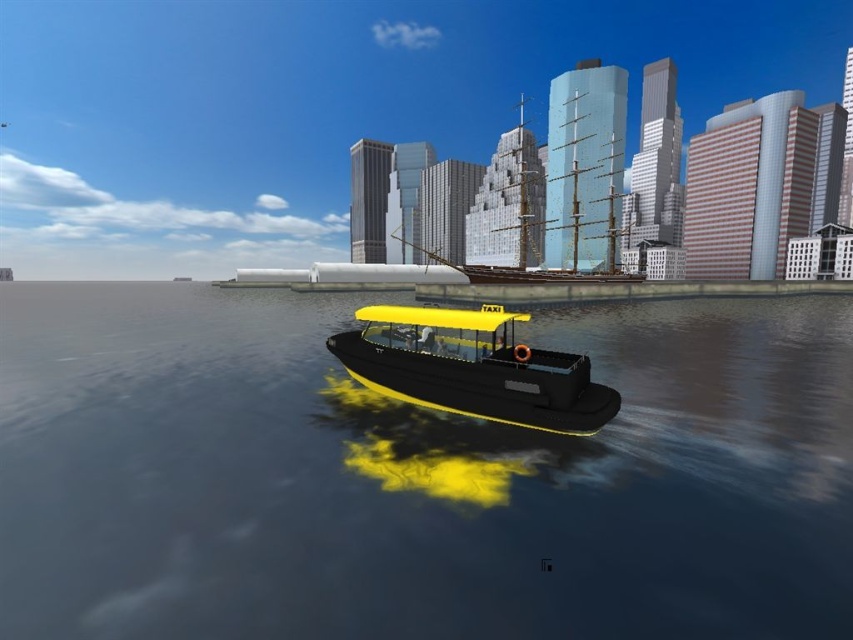
Question: Can you confirm if glossy water at boat center is thinner than yellow matte taxi boat at center?

Choices:
 (A) no
 (B) yes

Answer: (A)

Question: Observing the image, what is the correct spatial positioning of glossy water at boat center in reference to yellow matte taxi boat at center?

Choices:
 (A) right
 (B) left

Answer: (B)

Question: Which point is closer to the camera taking this photo?

Choices:
 (A) (331, 321)
 (B) (560, 397)
 (C) (390, 236)

Answer: (B)

Question: Which of the following is the closest to the observer?

Choices:
 (A) (598, 426)
 (B) (306, 362)

Answer: (A)

Question: Can you confirm if glossy water at boat center is positioned to the left of yellow matte taxi boat at center?

Choices:
 (A) yes
 (B) no

Answer: (A)

Question: Among these points, which one is farthest from the camera?

Choices:
 (A) (844, 488)
 (B) (611, 140)

Answer: (B)